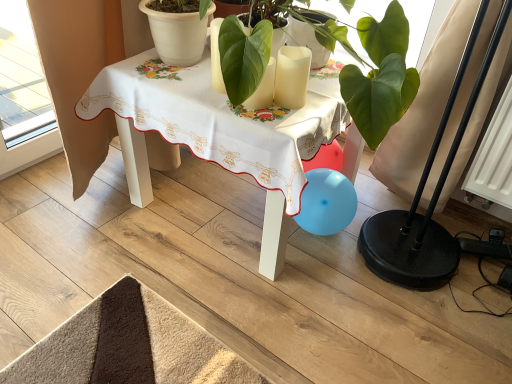
Question: Is the position of white matte flowerpot at upper center more distant than that of white fabric table at center?

Choices:
 (A) yes
 (B) no

Answer: (A)

Question: Would you say white matte flowerpot at upper center is outside white fabric table at center?

Choices:
 (A) yes
 (B) no

Answer: (A)

Question: Does white matte flowerpot at upper center have a larger size compared to white fabric table at center?

Choices:
 (A) yes
 (B) no

Answer: (B)

Question: Is white matte flowerpot at upper center smaller than white fabric table at center?

Choices:
 (A) no
 (B) yes

Answer: (B)

Question: Is white matte flowerpot at upper center in contact with white fabric table at center?

Choices:
 (A) no
 (B) yes

Answer: (A)

Question: From their relative heights in the image, would you say white matte candle at center is taller or shorter than white fabric table at center?

Choices:
 (A) short
 (B) tall

Answer: (A)

Question: Considering the positions of white matte candle at center and white fabric table at center in the image, is white matte candle at center bigger or smaller than white fabric table at center?

Choices:
 (A) small
 (B) big

Answer: (A)

Question: From the image's perspective, is white matte candle at center above or below white fabric table at center?

Choices:
 (A) below
 (B) above

Answer: (B)

Question: From a real-world perspective, is white matte candle at center positioned above or below white fabric table at center?

Choices:
 (A) above
 (B) below

Answer: (A)

Question: Is point (269, 150) closer or farther from the camera than point (293, 74)?

Choices:
 (A) farther
 (B) closer

Answer: (B)

Question: From a real-world perspective, is white fabric table at center physically located above or below white matte candle at center?

Choices:
 (A) below
 (B) above

Answer: (A)

Question: In the image, is white fabric table at center on the left side or the right side of white matte candle at center?

Choices:
 (A) left
 (B) right

Answer: (A)

Question: In the image, is white fabric table at center positioned in front of or behind white matte candle at center?

Choices:
 (A) behind
 (B) front

Answer: (B)

Question: Looking at their shapes, would you say white matte candle at center is wider or thinner than white matte flowerpot at upper center?

Choices:
 (A) thin
 (B) wide

Answer: (A)

Question: Do you think white matte candle at center is within white matte flowerpot at upper center, or outside of it?

Choices:
 (A) outside
 (B) inside

Answer: (A)